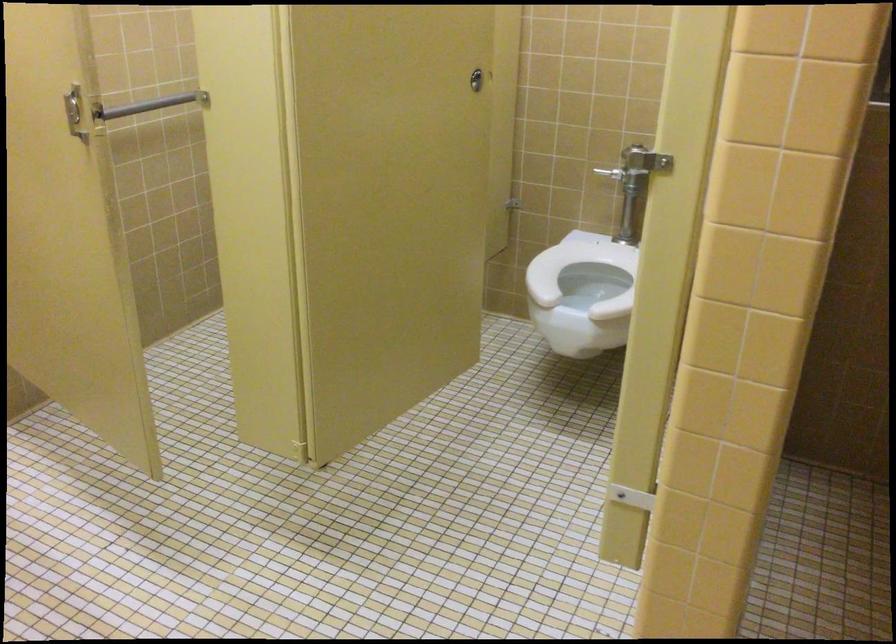
The image size is (896, 644). What do you see at coordinates (644, 160) in the screenshot?
I see `a stall door latch` at bounding box center [644, 160].